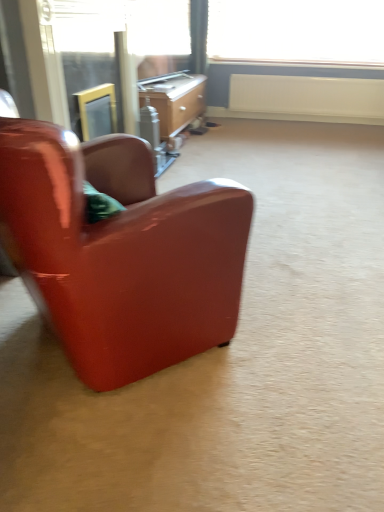
Question: Could you tell me if clear glass screen door at upper left, which is counted as the 1th screen door, starting from the right, is facing white matte radiator at upper center?

Choices:
 (A) yes
 (B) no

Answer: (B)

Question: Are clear glass screen door at upper left, which is counted as the 1th screen door, starting from the right, and white matte radiator at upper center making contact?

Choices:
 (A) no
 (B) yes

Answer: (A)

Question: Considering the relative sizes of clear glass screen door at upper left, positioned as the 2th screen door in left-to-right order, and white matte radiator at upper center in the image provided, is clear glass screen door at upper left, positioned as the 2th screen door in left-to-right order, thinner than white matte radiator at upper center?

Choices:
 (A) yes
 (B) no

Answer: (B)

Question: From a real-world perspective, is clear glass screen door at upper left, which is counted as the 1th screen door, starting from the right, over white matte radiator at upper center?

Choices:
 (A) yes
 (B) no

Answer: (A)

Question: Is clear glass screen door at upper left, positioned as the 2th screen door in left-to-right order, behind white matte radiator at upper center?

Choices:
 (A) no
 (B) yes

Answer: (A)

Question: Considering the relative sizes of clear glass screen door at upper left, positioned as the 2th screen door in left-to-right order, and white matte radiator at upper center in the image provided, is clear glass screen door at upper left, positioned as the 2th screen door in left-to-right order, shorter than white matte radiator at upper center?

Choices:
 (A) yes
 (B) no

Answer: (B)

Question: Is white matte radiator at upper center completely or partially outside of transparent plastic window screen at upper center?

Choices:
 (A) yes
 (B) no

Answer: (A)

Question: From the image's perspective, is white matte radiator at upper center under transparent plastic window screen at upper center?

Choices:
 (A) yes
 (B) no

Answer: (A)

Question: From the image's perspective, is white matte radiator at upper center on transparent plastic window screen at upper center?

Choices:
 (A) no
 (B) yes

Answer: (A)

Question: Is white matte radiator at upper center to the left of transparent plastic window screen at upper center from the viewer's perspective?

Choices:
 (A) no
 (B) yes

Answer: (A)

Question: Can you confirm if white matte radiator at upper center is wider than transparent plastic window screen at upper center?

Choices:
 (A) yes
 (B) no

Answer: (B)

Question: From a real-world perspective, is white matte radiator at upper center located higher than transparent plastic window screen at upper center?

Choices:
 (A) yes
 (B) no

Answer: (B)

Question: Is wooden desk at center to the right of glossy leather chair at left from the viewer's perspective?

Choices:
 (A) no
 (B) yes

Answer: (B)